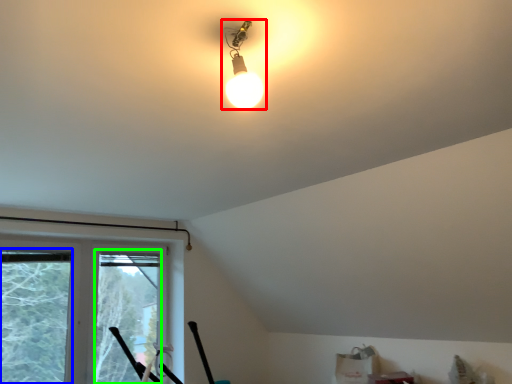
Question: Estimate the real-world distances between objects in this image. Which object is farther from lamp (highlighted by a red box), window screen (highlighted by a blue box) or window screen (highlighted by a green box)?

Choices:
 (A) window screen
 (B) window screen

Answer: (B)